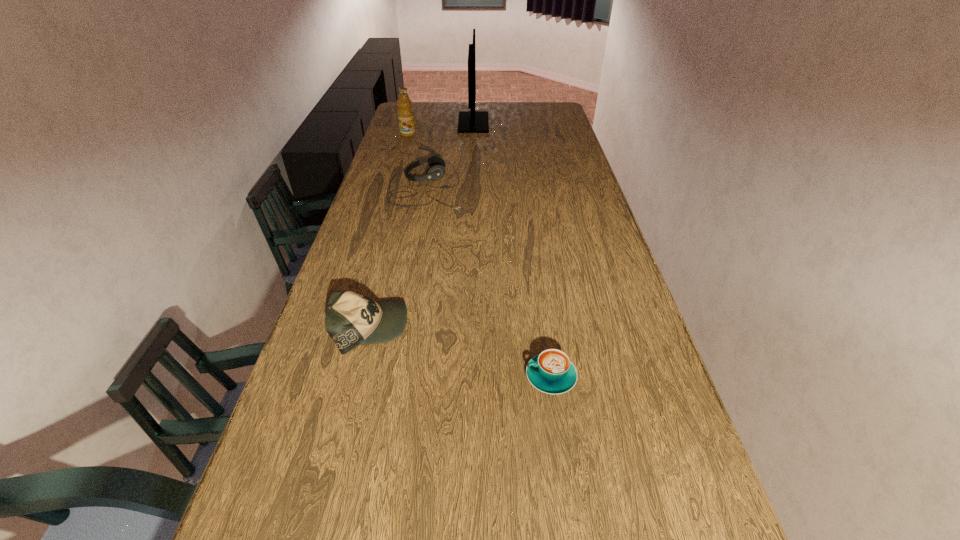
The width and height of the screenshot is (960, 540). Identify the location of unoccupied area between the shortest object and the tallest object. (513, 249).

Locate an element on the screen. This screenshot has height=540, width=960. free space between the monitor and the third farthest object is located at coordinates (449, 154).

Where is `unoccupied position between the tallest object and the headset`? The image size is (960, 540). unoccupied position between the tallest object and the headset is located at coordinates (449, 154).

Locate an element on the screen. vacant area that lies between the shortest object and the monitor is located at coordinates (513, 249).

You are a GUI agent. You are given a task and a screenshot of the screen. Output one action in this format:
    pyautogui.click(x=<x>, y=<y>)
    Task: Click on the vacant area that lies between the cappuccino and the monitor
    This screenshot has height=540, width=960.
    Given the screenshot: What is the action you would take?
    pyautogui.click(x=513, y=249)

The width and height of the screenshot is (960, 540). I want to click on unoccupied area between the monitor and the baseball cap, so click(421, 225).

The width and height of the screenshot is (960, 540). In order to click on free spot between the headset and the baseball cap in this screenshot , I will do `click(398, 257)`.

Locate an element on the screen. This screenshot has height=540, width=960. free space between the olive oil and the monitor is located at coordinates (441, 129).

Image resolution: width=960 pixels, height=540 pixels. What are the coordinates of `free space between the rightmost object and the fourth shortest object` in the screenshot? It's located at (479, 255).

I want to click on vacant area between the shortest object and the second tallest object, so click(x=479, y=255).